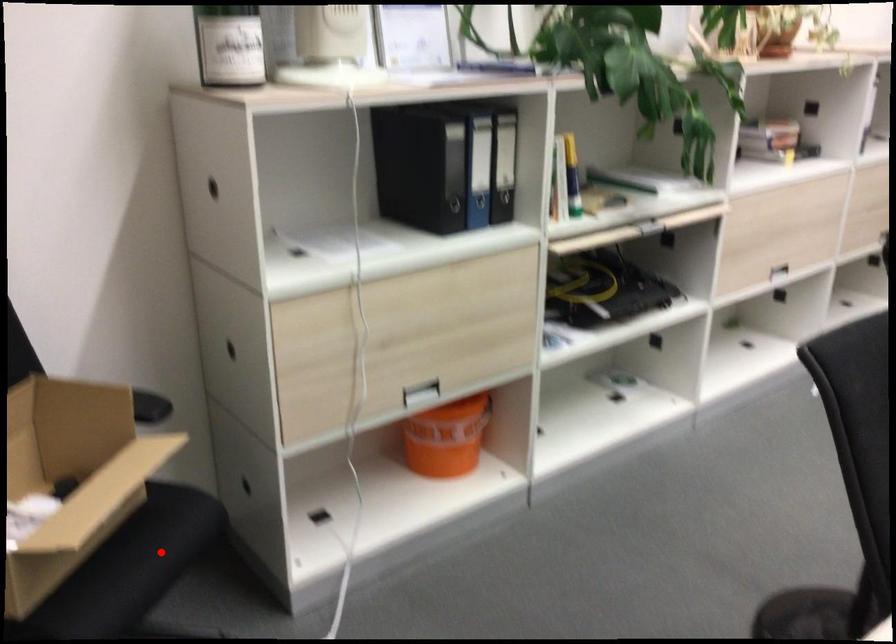
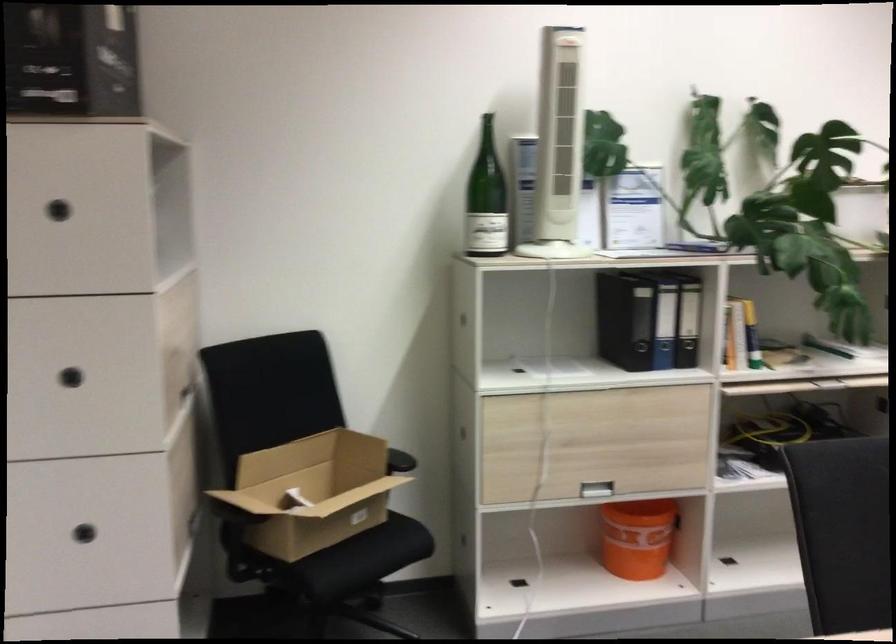
Question: I am providing you with two images of the same scene from different viewpoints. A red point is marked on the first image. At the location where the point appears in image 1, is it still visible in image 2?

Choices:
 (A) Yes
 (B) No

Answer: (A)